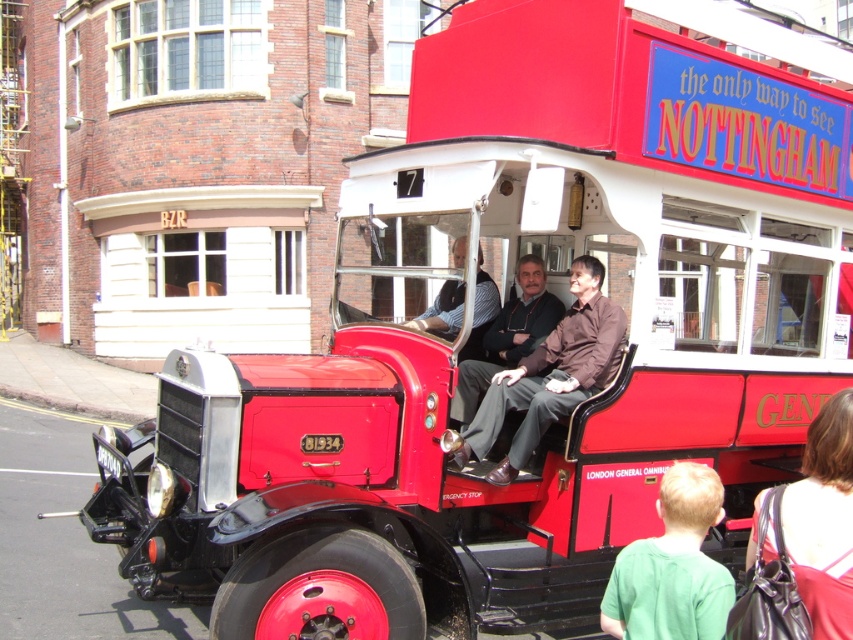
You are standing at the back of the vintage red bus and want to move to the front. Which point, point 1 at point (703, 513) or point 2 at point (502, 321), is closer to the front of the bus?

Point 1 at point (703, 513) is closer to the front of the bus because it is in front of point 2 at point (502, 321).